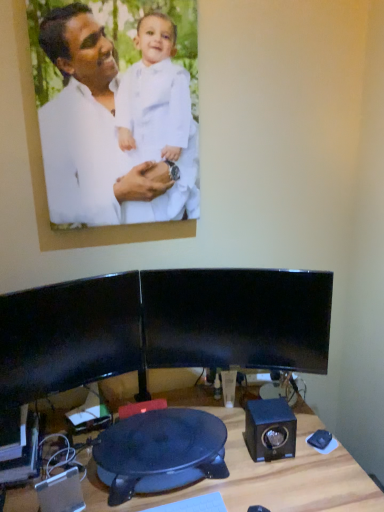
Identify the location of free space above wooden desk at lower center (from a real-world perspective). (208, 466).